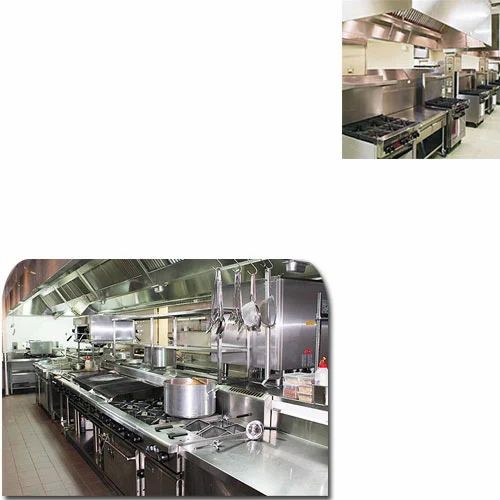
Identify the location of hooks. (266, 267), (253, 267), (238, 265), (220, 264).